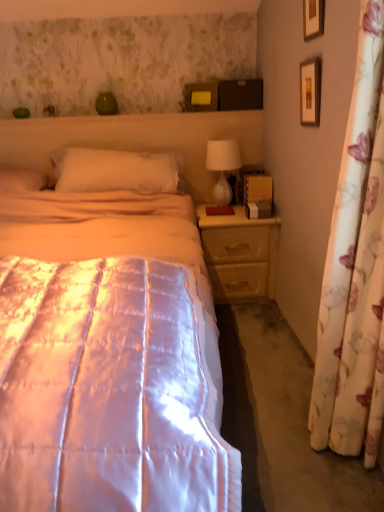
The height and width of the screenshot is (512, 384). Find the location of `blank space situated above light wood/texture nightstand at right (from a real-world perspective)`. blank space situated above light wood/texture nightstand at right (from a real-world perspective) is located at coordinates (218, 211).